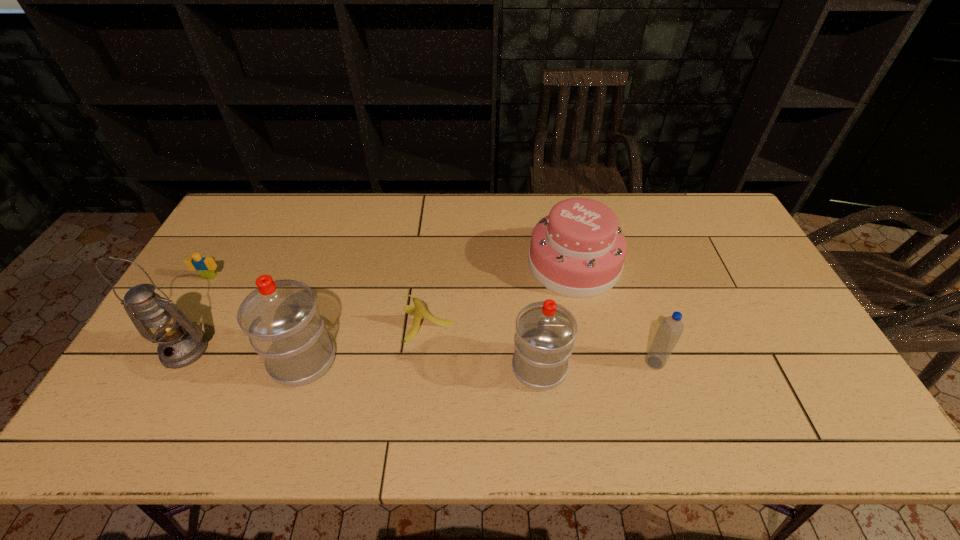
Locate an element on the screen. vacant space situated on the handle side of the fifth object from right to left is located at coordinates (328, 282).

You are a GUI agent. You are given a task and a screenshot of the screen. Output one action in this format:
    pyautogui.click(x=<x>, y=<y>)
    Task: Click on the free space located 0.090m on the handle side of the fifth object from right to left
    
    Given the screenshot: What is the action you would take?
    pyautogui.click(x=320, y=308)

Locate an element on the screen. vacant space located 0.370m on the handle side of the fifth object from right to left is located at coordinates (341, 243).

Locate an element on the screen. free spot located 0.060m on the handle side of the second water bottle from left to right is located at coordinates [535, 327].

Find the location of a particular element. vacant space located on the handle side of the second water bottle from left to right is located at coordinates (533, 305).

This screenshot has height=540, width=960. What are the coordinates of `vacant space located 0.300m on the handle side of the second water bottle from left to right` in the screenshot? It's located at (528, 266).

I want to click on free point located on the left of the banana, so click(366, 324).

This screenshot has height=540, width=960. Identify the location of vacant space positioned on the face of the Lego. (152, 375).

I want to click on vacant area located 0.180m on the right of the oil lamp, so click(281, 350).

The width and height of the screenshot is (960, 540). In order to click on free spot located on the front of the cake in this screenshot , I will do `click(586, 320)`.